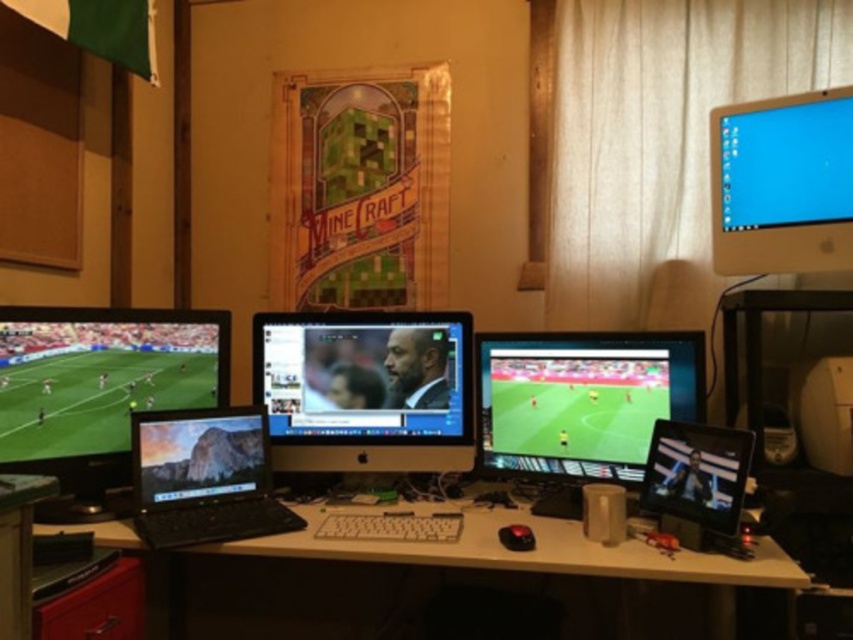
Question: Among these objects, which one is farthest from the camera?

Choices:
 (A) matte black monitor at left
 (B) white matte computer desk at center

Answer: (A)

Question: Is matte black monitor at center to the left of white plastic keyboard at center from the viewer's perspective?

Choices:
 (A) yes
 (B) no

Answer: (B)

Question: Among these objects, which one is nearest to the camera?

Choices:
 (A) white matte computer desk at center
 (B) satin black monitor at center

Answer: (A)

Question: Can you confirm if matte black monitor at left is positioned to the left of white glossy monitor at upper right?

Choices:
 (A) no
 (B) yes

Answer: (B)

Question: Among these points, which one is nearest to the camera?

Choices:
 (A) (809, 211)
 (B) (444, 465)
 (C) (86, 314)
 (D) (680, 369)

Answer: (D)

Question: Can you confirm if satin black monitor at center is bigger than white plastic keyboard at center?

Choices:
 (A) yes
 (B) no

Answer: (A)